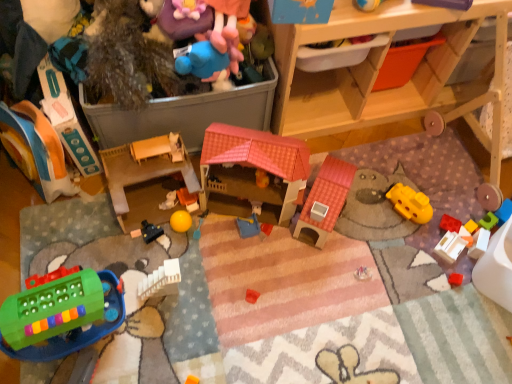
The image size is (512, 384). I want to click on free space to the left of wooden dollhouse at center-left, the 4th toy from the left, so click(x=84, y=221).